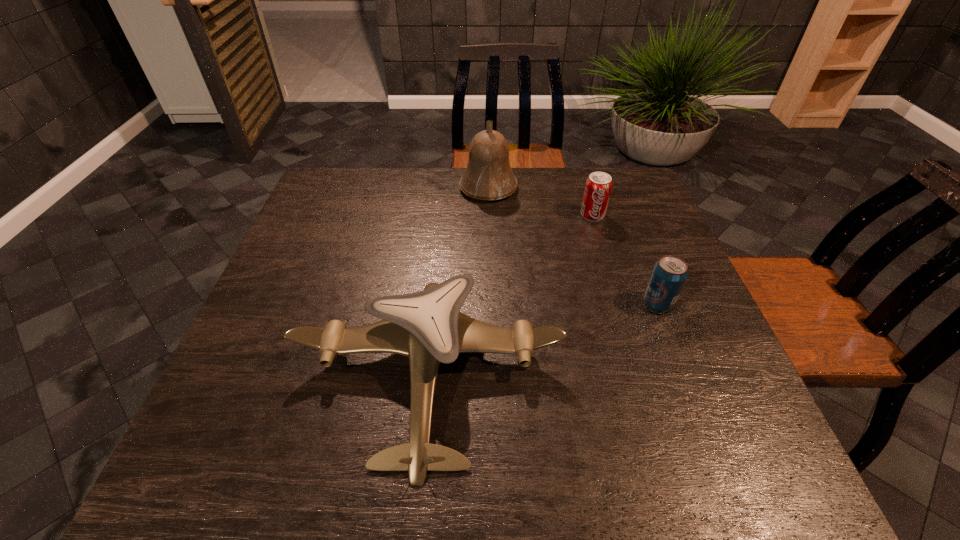
Where is `bell that is at the far edge`? The width and height of the screenshot is (960, 540). bell that is at the far edge is located at coordinates (488, 176).

The image size is (960, 540). I want to click on soda can located at the far edge, so click(598, 186).

Where is `object situated at the near edge`? Image resolution: width=960 pixels, height=540 pixels. object situated at the near edge is located at coordinates (427, 326).

Locate an element on the screen. The width and height of the screenshot is (960, 540). object that is at the left edge is located at coordinates (427, 326).

The height and width of the screenshot is (540, 960). What are the coordinates of `object that is at the near left corner` in the screenshot? It's located at (427, 326).

Locate an element on the screen. The image size is (960, 540). object that is at the far right corner is located at coordinates (598, 186).

In the image, there is a desktop. Identify the location of vacant space at the far edge. This screenshot has width=960, height=540. (443, 174).

At what (x,y) coordinates should I click in order to perform the action: click on vacant space at the near edge of the desktop. Please return your answer as a coordinate pair (x, y). Looking at the image, I should click on (506, 459).

In the image, there is a desktop. At what (x,y) coordinates should I click in order to perform the action: click on vacant area at the left edge. Please return your answer as a coordinate pair (x, y). The width and height of the screenshot is (960, 540). Looking at the image, I should click on (212, 426).

Locate an element on the screen. The height and width of the screenshot is (540, 960). vacant space at the right edge of the desktop is located at coordinates (662, 230).